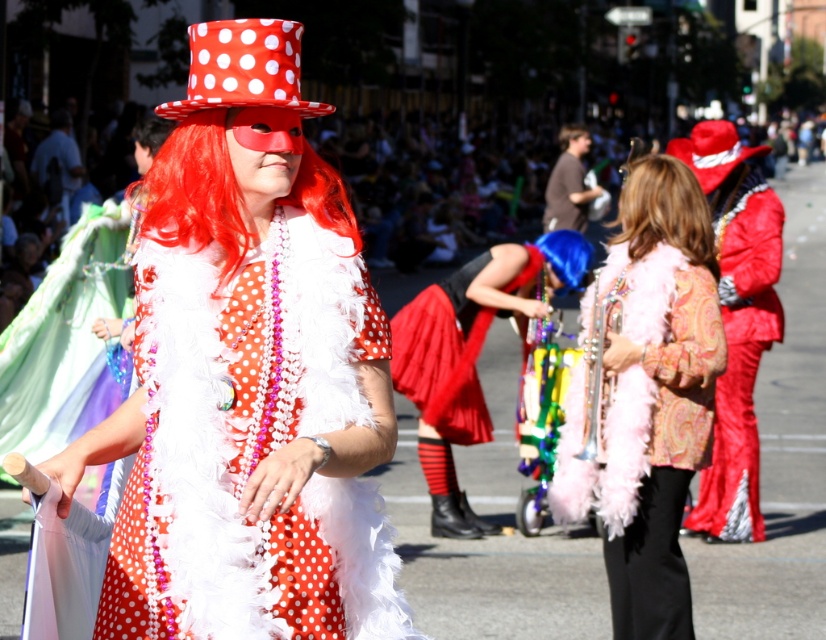
Does red feather boa at center have a lesser width compared to red felt hat at center?

Yes.

Who is positioned more to the left, red feather boa at center or red felt hat at center?

Positioned to the left is red feather boa at center.

Is point (335, 195) behind point (725, 168)?

No, it is not.

This screenshot has width=826, height=640. I want to click on red feather boa at center, so click(196, 192).

Is point (551, 180) less distant than point (143, 148)?

No.

Can you confirm if matte brown shirt at center is shorter than red synthetic wig at left?

In fact, matte brown shirt at center may be taller than red synthetic wig at left.

Who is more distant from viewer, (549,179) or (146,144)?

Positioned behind is point (549,179).

Locate an element on the screen. This screenshot has width=826, height=640. matte brown shirt at center is located at coordinates (568, 182).

Based on the photo, measure the distance from red felt hat at center to brown curly hair at center.

The distance of red felt hat at center from brown curly hair at center is 6.61 meters.

Is red felt hat at center thinner than brown curly hair at center?

Incorrect, red felt hat at center's width is not less than brown curly hair at center's.

The image size is (826, 640). I want to click on red felt hat at center, so click(x=711, y=150).